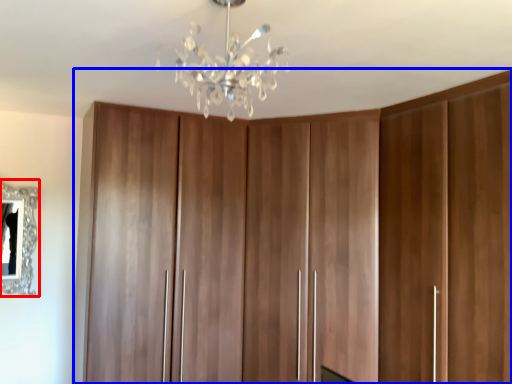
Question: Which object is closer to the camera taking this photo, mirror (highlighted by a red box) or cupboard (highlighted by a blue box)?

Choices:
 (A) mirror
 (B) cupboard

Answer: (B)